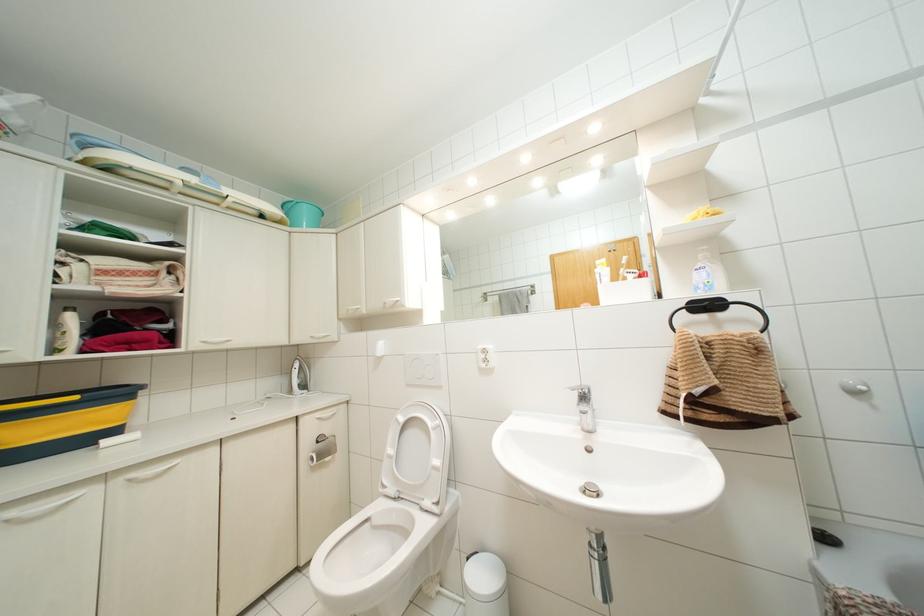
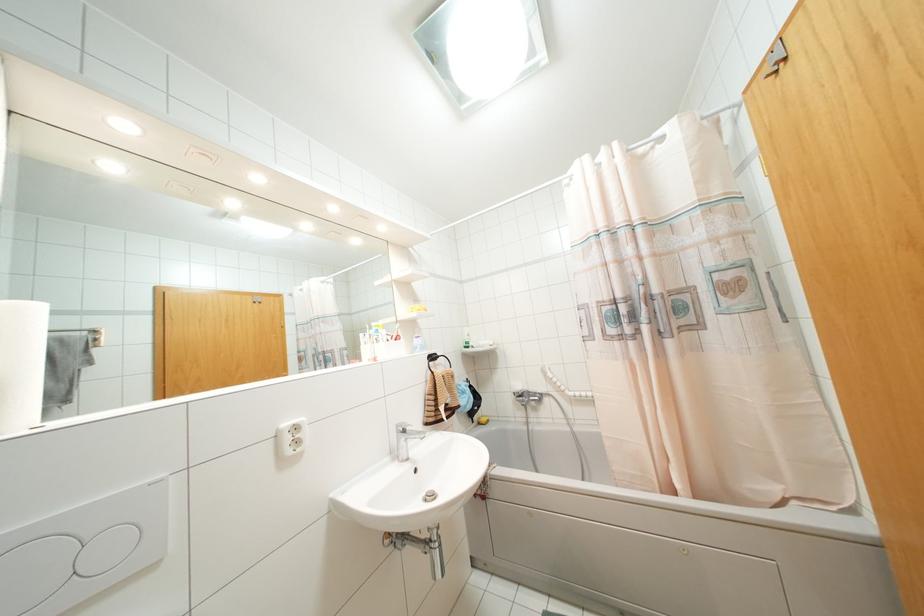
Where in the second image is the point corresponding to [584,395] from the first image?

(404, 431)